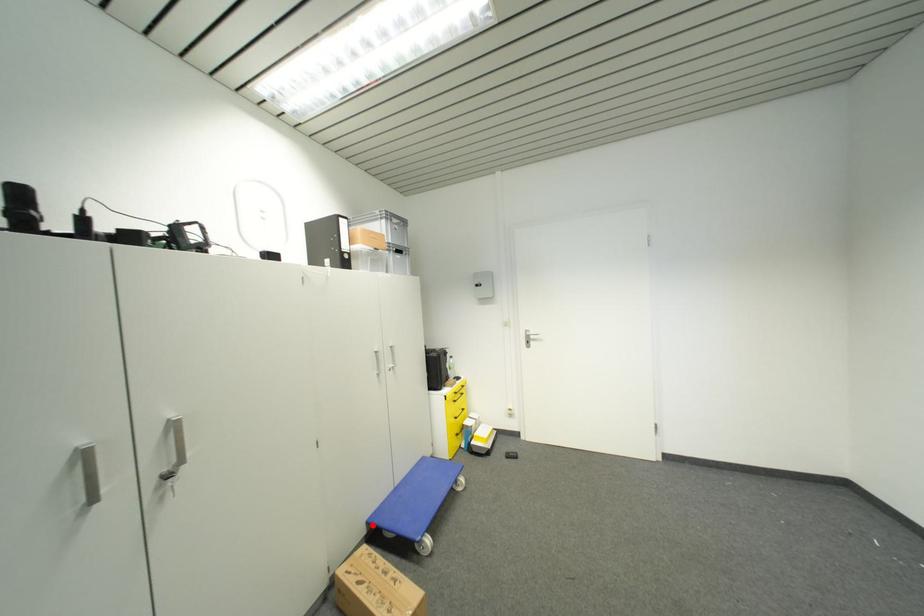
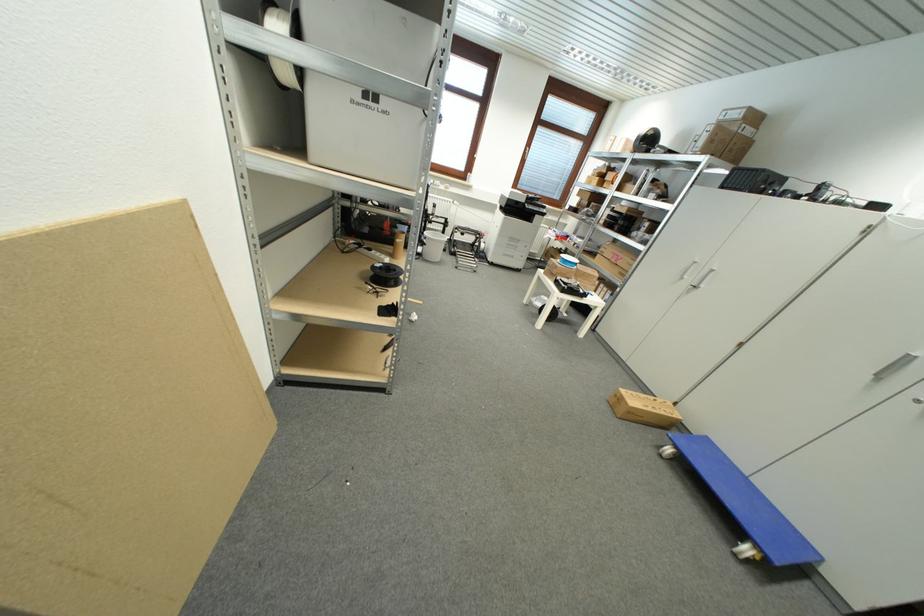
Question: I am providing you with two images of the same scene from different viewpoints. In image1, a red point is highlighted. Considering the same 3D point in image2, which of the following is correct?

Choices:
 (A) It is closer
 (B) It is farther

Answer: (A)